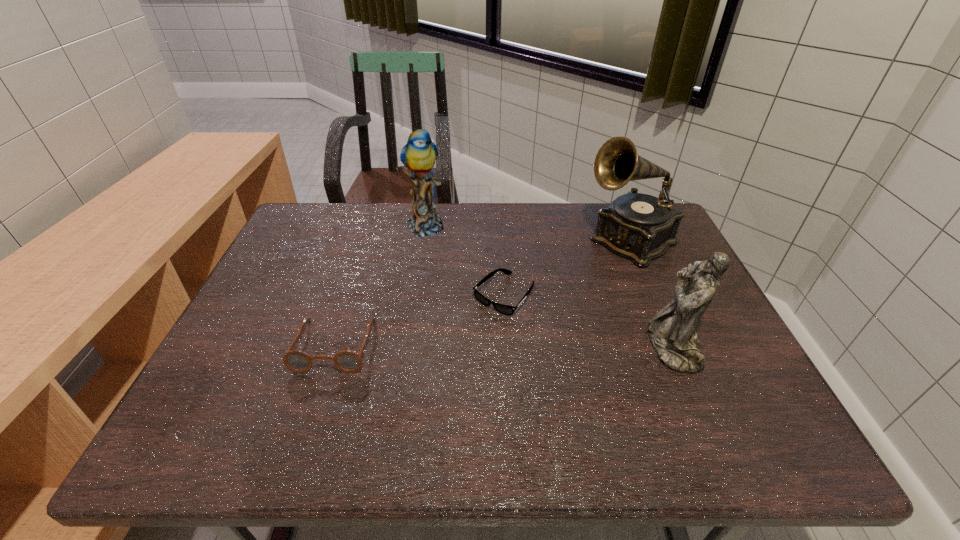
Where is `the leftmost object`? The image size is (960, 540). the leftmost object is located at coordinates (347, 361).

Find the location of a particular element. The height and width of the screenshot is (540, 960). spectacles is located at coordinates (347, 361).

Find the location of `the third tallest object`. the third tallest object is located at coordinates (671, 333).

At what (x,y) coordinates should I click in order to perform the action: click on phonograph record. Please return your answer as a coordinate pair (x, y). The width and height of the screenshot is (960, 540). Looking at the image, I should click on (640, 227).

This screenshot has width=960, height=540. Find the location of `the fourth object from right to left`. the fourth object from right to left is located at coordinates (419, 154).

The width and height of the screenshot is (960, 540). I want to click on the third object from right to left, so click(x=508, y=310).

Locate an element on the screen. The width and height of the screenshot is (960, 540). sunglasses is located at coordinates (508, 310).

Locate an element on the screen. The height and width of the screenshot is (540, 960). vacant area situated 0.050m on the front-facing side of the second shortest object is located at coordinates (319, 394).

Locate an element on the screen. This screenshot has height=540, width=960. vacant area situated 0.180m on the front-facing side of the third shortest object is located at coordinates (572, 347).

You are a GUI agent. You are given a task and a screenshot of the screen. Output one action in this format:
    pyautogui.click(x=<x>, y=<y>)
    Task: Click on the free point located on the front-facing side of the third shortest object
    The width and height of the screenshot is (960, 540).
    Given the screenshot: What is the action you would take?
    click(520, 347)